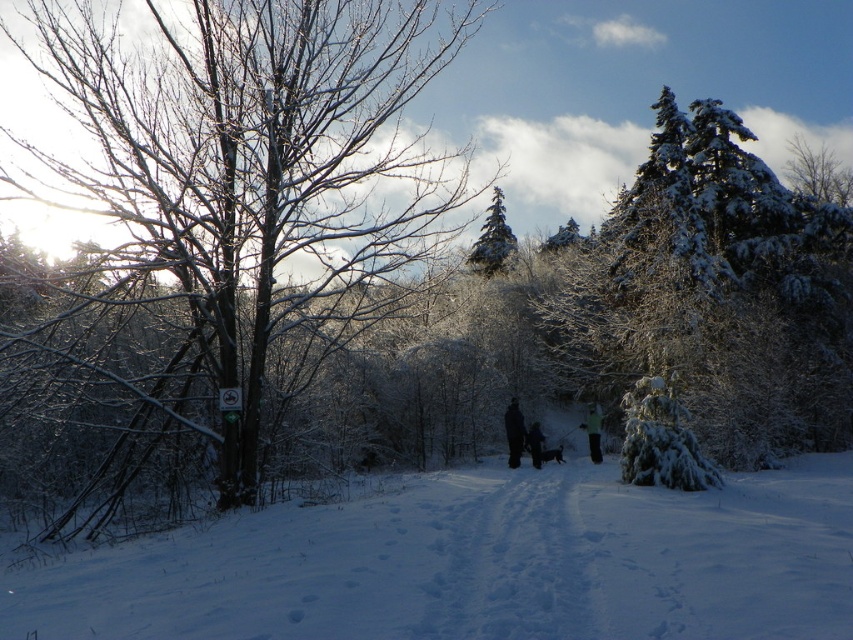
Question: Among these points, which one is farthest from the camera?

Choices:
 (A) (532, 458)
 (B) (509, 422)
 (C) (128, 461)

Answer: (B)

Question: Can you confirm if snow-covered tree at left is smaller than white fluffy snow at center?

Choices:
 (A) yes
 (B) no

Answer: (B)

Question: Which point is closer to the camera?

Choices:
 (A) snow-covered tree at left
 (B) snow-covered evergreen at upper right

Answer: (A)

Question: Does snow-covered tree at left have a smaller size compared to green glossy evergreen tree at upper center?

Choices:
 (A) yes
 (B) no

Answer: (B)

Question: In this image, where is snow-covered tree at left located relative to black matte person at center?

Choices:
 (A) above
 (B) below

Answer: (A)

Question: Which point appears farthest from the camera in this image?

Choices:
 (A) (312, 272)
 (B) (494, 234)

Answer: (B)